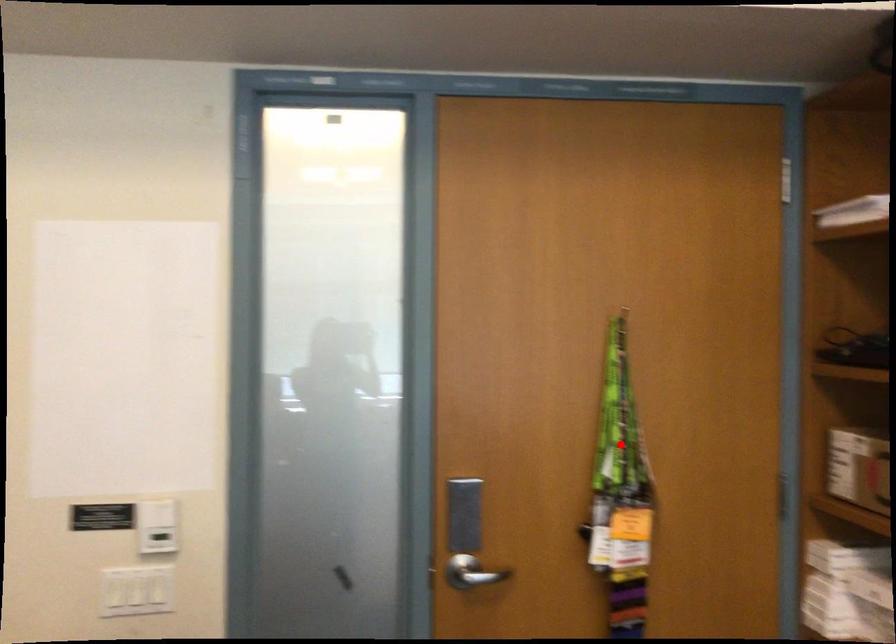
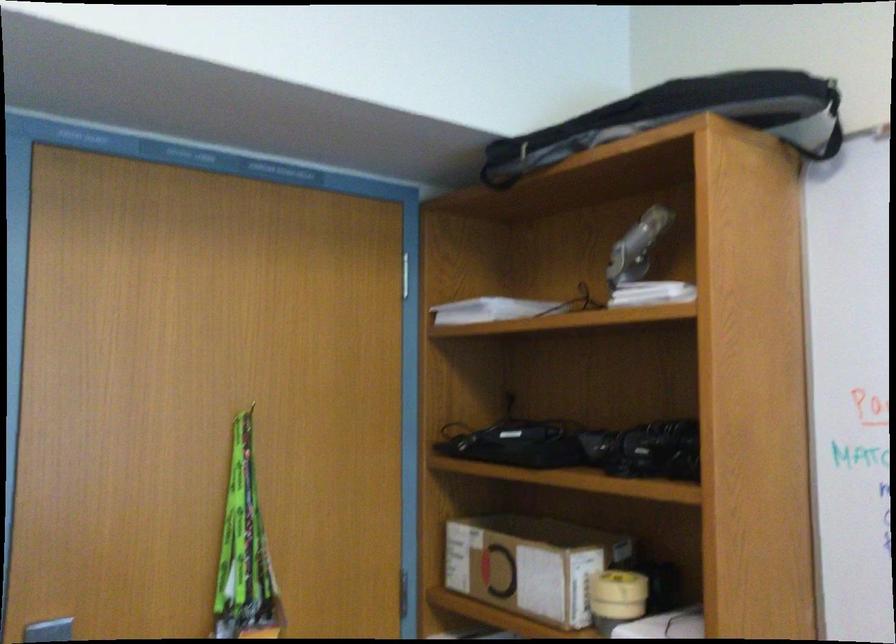
Find the pixel in the second image that matches the highlighted location in the first image.

(244, 547)